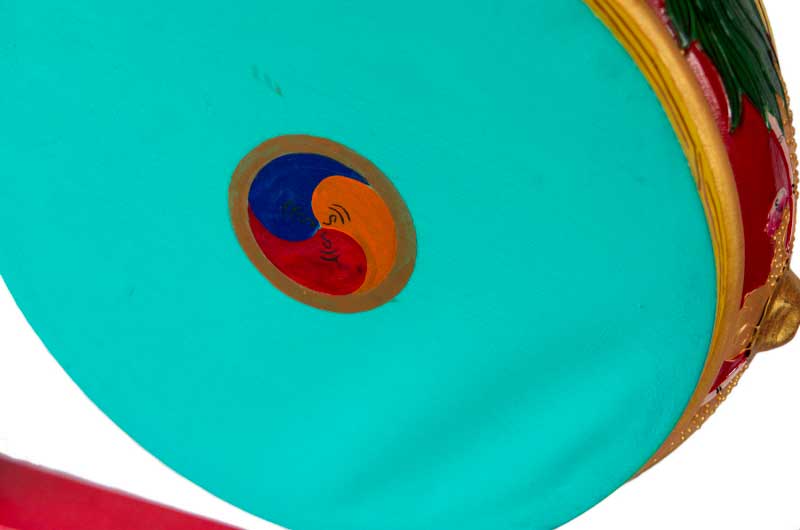
Where is `gold adornments`? gold adornments is located at coordinates (773, 322), (708, 403), (781, 235).